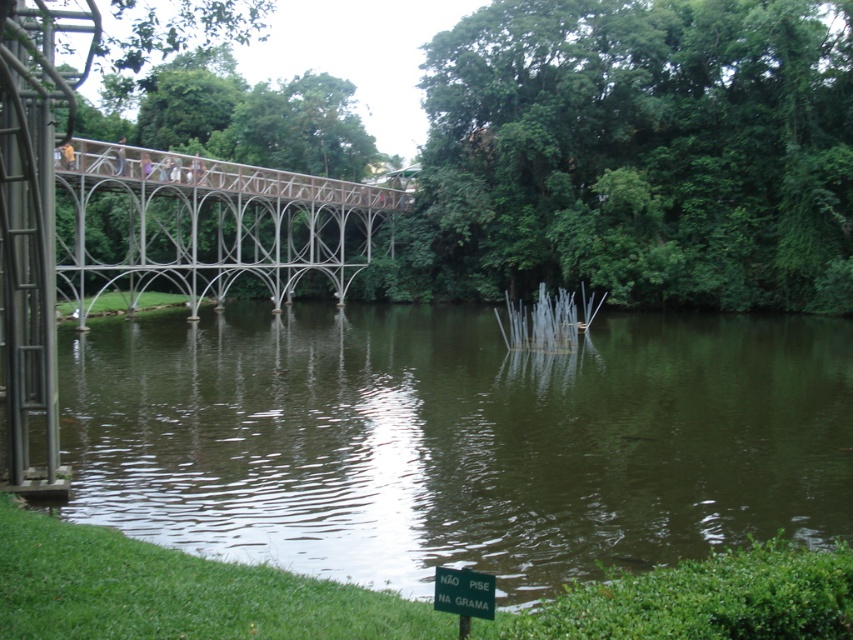
Question: Which point is closer to the camera?

Choices:
 (A) green reflective water at center
 (B) green plastic sign at lower center

Answer: (B)

Question: Is green reflective water at center bigger than metallic bridge at upper center?

Choices:
 (A) no
 (B) yes

Answer: (A)

Question: Which object is closer to the camera taking this photo?

Choices:
 (A) metallic bridge at upper center
 (B) green reflective water at center
 (C) green plastic sign at lower center

Answer: (C)

Question: Can you confirm if green reflective water at center is bigger than metallic bridge at upper center?

Choices:
 (A) yes
 (B) no

Answer: (B)

Question: Among these objects, which one is farthest from the camera?

Choices:
 (A) green reflective water at center
 (B) green plastic sign at lower center
 (C) metallic bridge at upper center

Answer: (C)

Question: Is green reflective water at center positioned behind green plastic sign at lower center?

Choices:
 (A) yes
 (B) no

Answer: (A)